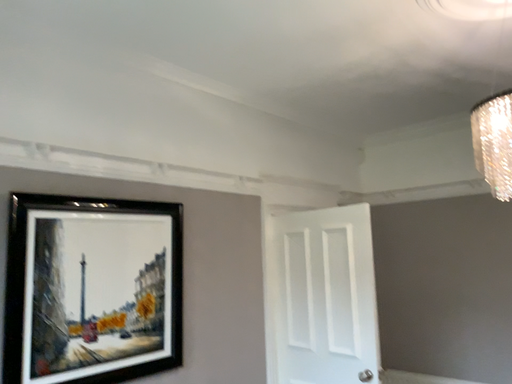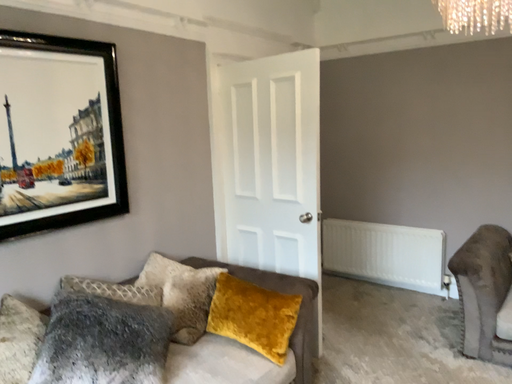
Question: How did the camera likely rotate when shooting the video?

Choices:
 (A) rotated downward
 (B) rotated upward

Answer: (A)